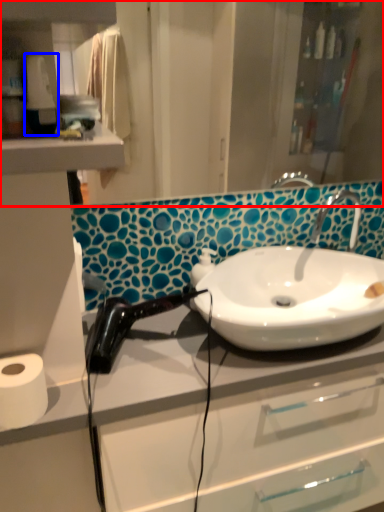
Question: Among these objects, which one is nearest to the camera, mirror (highlighted by a red box) or hand dryer (highlighted by a blue box)?

Choices:
 (A) mirror
 (B) hand dryer

Answer: (B)